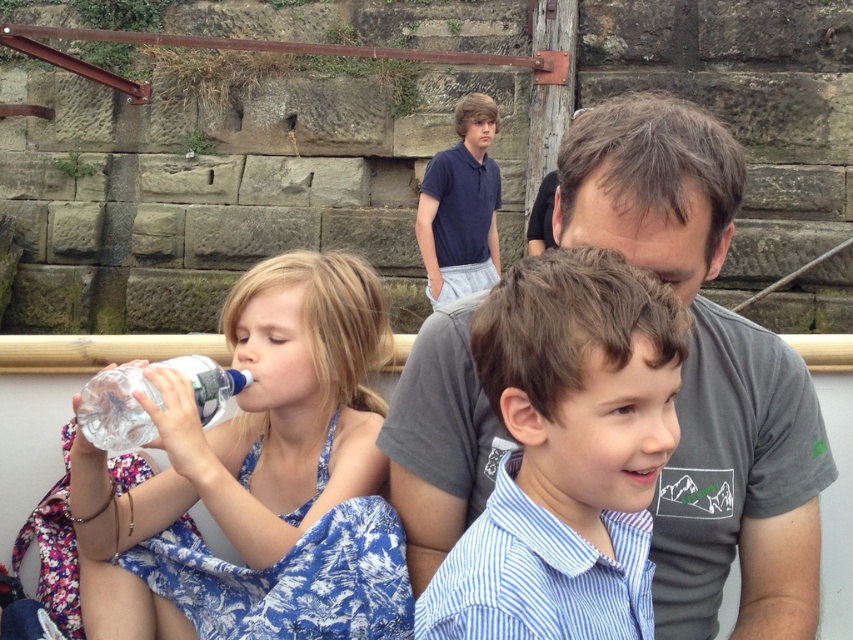
Question: Considering the real-world distances, which object is farthest from the blue striped shirt at center?

Choices:
 (A) gray cotton t-shirt at center
 (B) navy blue polo shirt at upper center
 (C) clear plastic bottle at center
 (D) transparent plastic bottle at left

Answer: (B)

Question: Which point is farther to the camera?

Choices:
 (A) (112, 401)
 (B) (659, 429)

Answer: (A)

Question: Can you confirm if gray cotton t-shirt at center is wider than blue striped shirt at center?

Choices:
 (A) no
 (B) yes

Answer: (B)

Question: Is navy blue polo shirt at upper center wider than clear plastic bottle at center?

Choices:
 (A) yes
 (B) no

Answer: (A)

Question: Does blue striped shirt at center lie behind navy blue polo shirt at upper center?

Choices:
 (A) yes
 (B) no

Answer: (B)

Question: Which of the following is the closest to the observer?

Choices:
 (A) (570, 292)
 (B) (468, 232)
 (C) (218, 397)
 (D) (604, 129)

Answer: (A)